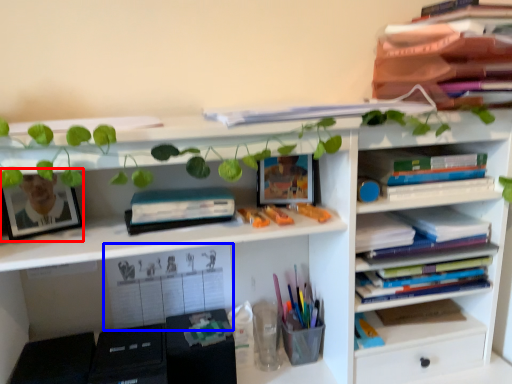
Question: Which of the following is the farthest to the observer, picture frame (highlighted by a red box) or book (highlighted by a blue box)?

Choices:
 (A) picture frame
 (B) book

Answer: (B)